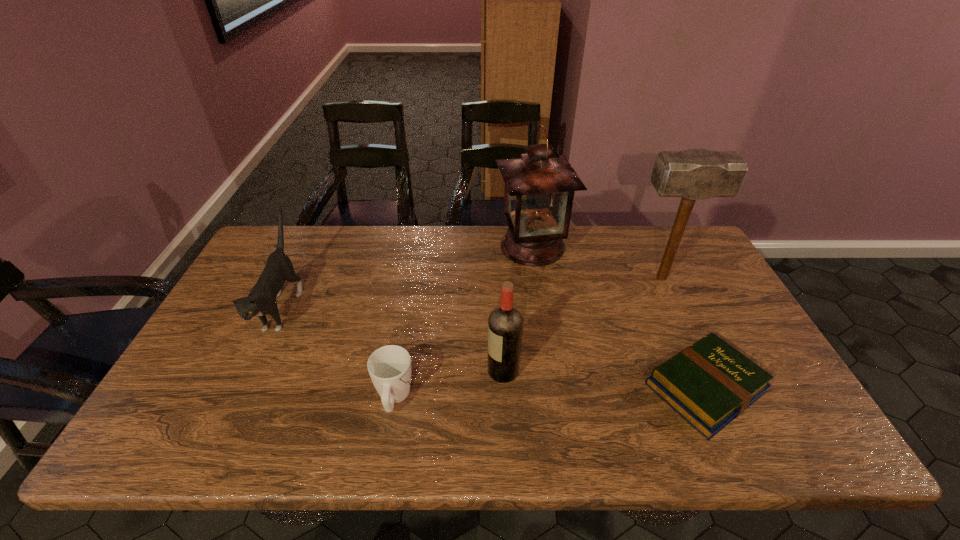
The width and height of the screenshot is (960, 540). Identify the location of oil lamp that is at the far edge. (539, 190).

Find the location of a particular element. The height and width of the screenshot is (540, 960). mallet that is at the far edge is located at coordinates (692, 174).

Where is `cat that is at the far edge`? The height and width of the screenshot is (540, 960). cat that is at the far edge is located at coordinates (261, 300).

Identify the location of mug located in the near edge section of the desktop. (389, 367).

The image size is (960, 540). I want to click on book that is positioned at the near edge, so click(x=710, y=383).

You are a GUI agent. You are given a task and a screenshot of the screen. Output one action in this format:
    pyautogui.click(x=<x>, y=<y>)
    Task: Click on the object that is at the left edge
    
    Given the screenshot: What is the action you would take?
    pyautogui.click(x=261, y=300)

The width and height of the screenshot is (960, 540). In order to click on mallet located at the right edge in this screenshot , I will do `click(692, 174)`.

You are a GUI agent. You are given a task and a screenshot of the screen. Output one action in this format:
    pyautogui.click(x=<x>, y=<y>)
    Task: Click on the book positioned at the right edge
    
    Given the screenshot: What is the action you would take?
    pyautogui.click(x=710, y=383)

This screenshot has width=960, height=540. I want to click on object present at the far left corner, so tap(261, 300).

This screenshot has width=960, height=540. I want to click on object that is at the far right corner, so click(x=692, y=174).